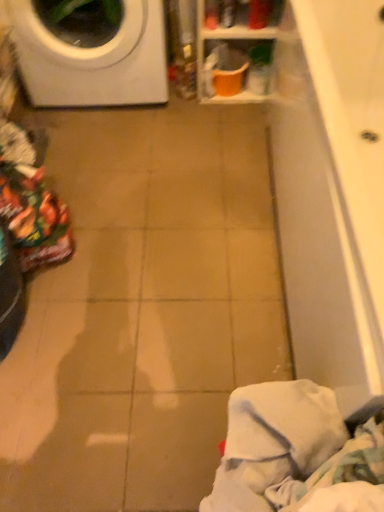
Image resolution: width=384 pixels, height=512 pixels. I want to click on vacant area that is in front of orange plastic bucket at upper center, so click(x=221, y=128).